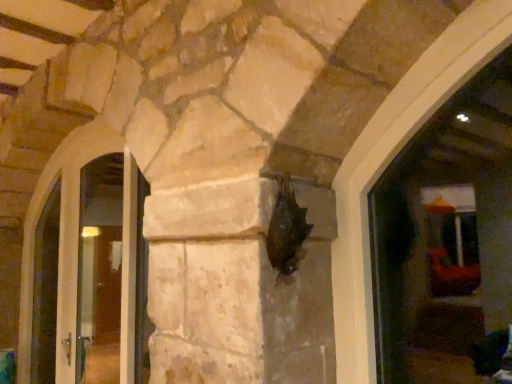
What are the coordinates of `clear glass door at left` in the screenshot? It's located at (90, 272).

This screenshot has width=512, height=384. Describe the element at coordinates (90, 272) in the screenshot. I see `clear glass door at left` at that location.

The width and height of the screenshot is (512, 384). Identify the location of clear glass door at left. (90, 272).